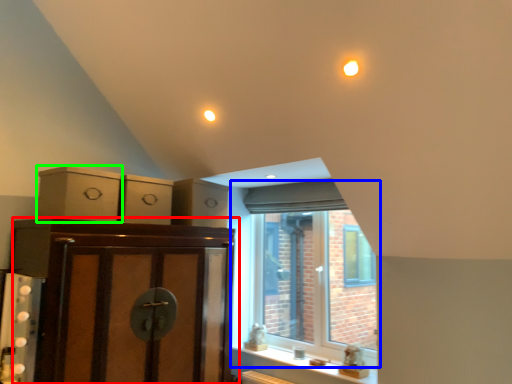
Question: Considering the real-world distances, which object is closest to cabinetry (highlighted by a red box)? window (highlighted by a blue box) or cabinetry (highlighted by a green box).

Choices:
 (A) window
 (B) cabinetry

Answer: (B)